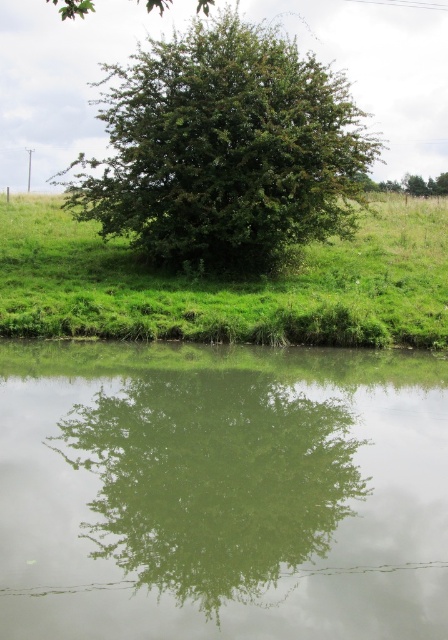
You are standing at the edge of the scene and want to walk towards the green grassy at center. Which direction should you move relative to the green reflective water at center?

To reach the green grassy at center, you should move to the right of the green reflective water at center since the green grassy at center is located to the right of the green reflective water at center.